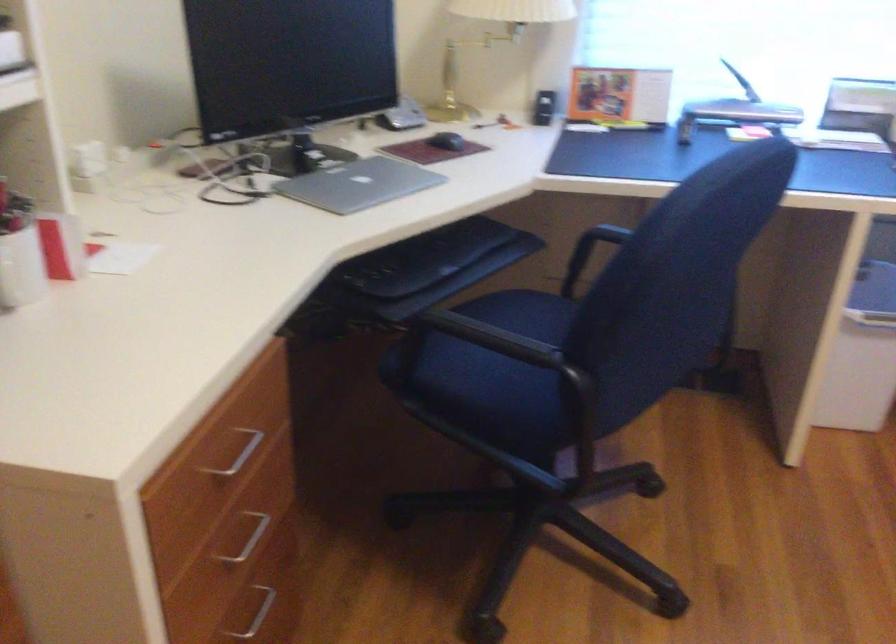
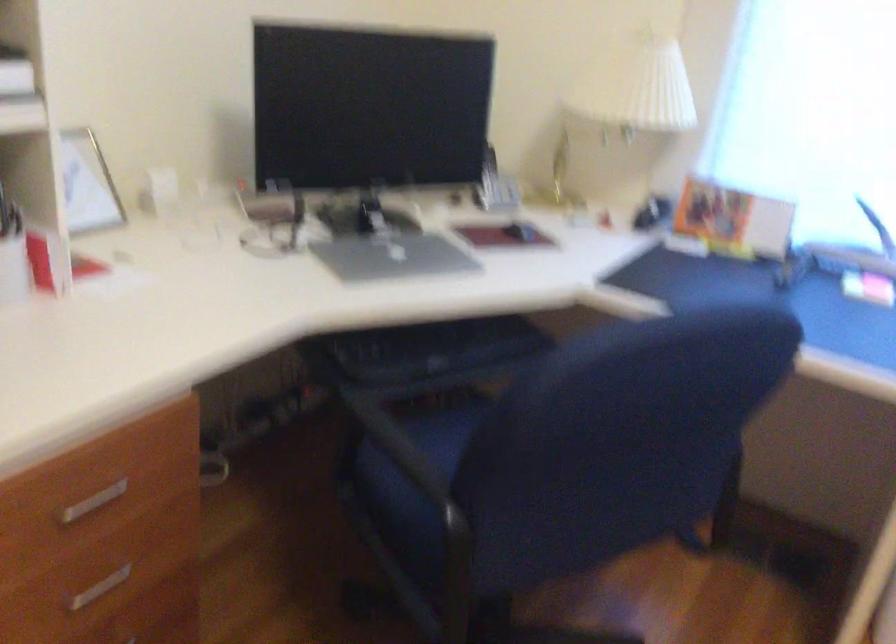
Question: How did the camera likely rotate?

Choices:
 (A) Left
 (B) Right
 (C) Up
 (D) Down

Answer: (A)